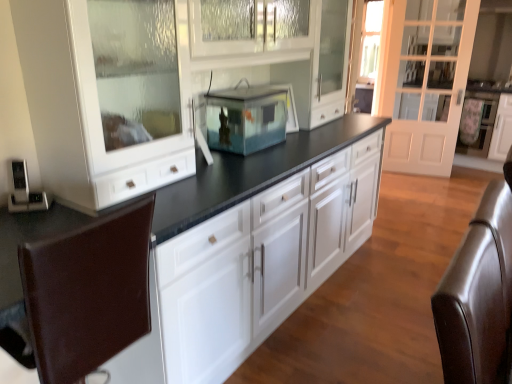
Find the location of a particular element. The height and width of the screenshot is (384, 512). free point above transparent glass fish tank at center (from a real-world perspective) is located at coordinates (247, 95).